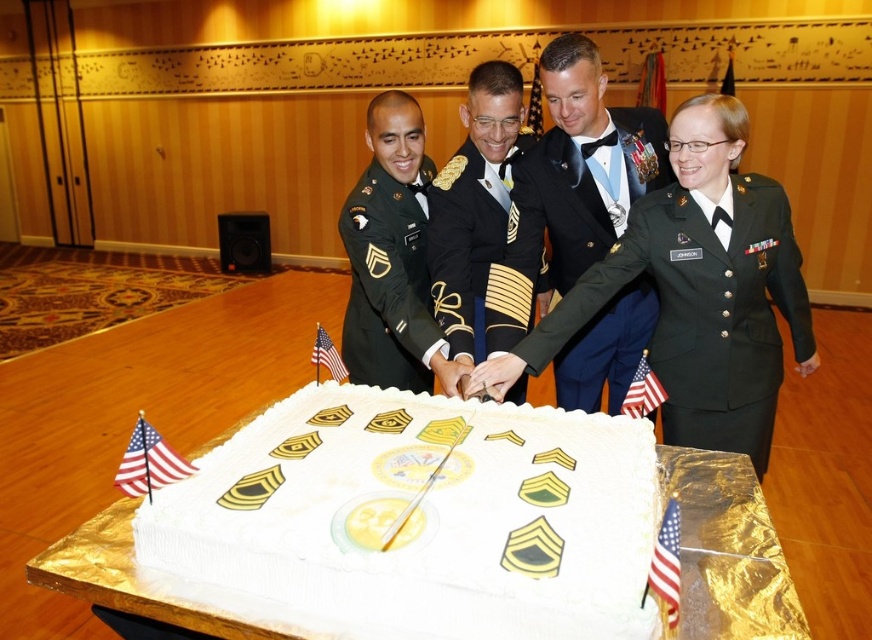
You are a photographer standing 3 feet away from the white frosted cake at center and the green military uniform at center. You want to take a photo that includes both subjects without any distortion. Can you fit both into the frame if your camera has a 50mm lens? Explain your reasoning.

The distance between the white frosted cake at center and the green military uniform at center is 29.26 inches. Since you are 3 feet away from both subjects, the total width required to capture both would be approximately 3 feet plus half of 29.26 inches. Converting 3 feet to inches gives 36 inches. Adding half of 29.26 inches gives 36 inches plus 14.63 inches, totaling 50.63 inches. A 50mm lens on a full frame camera typically has a field of view that can capture about 46 degrees horizontally. At 3 feet, 5